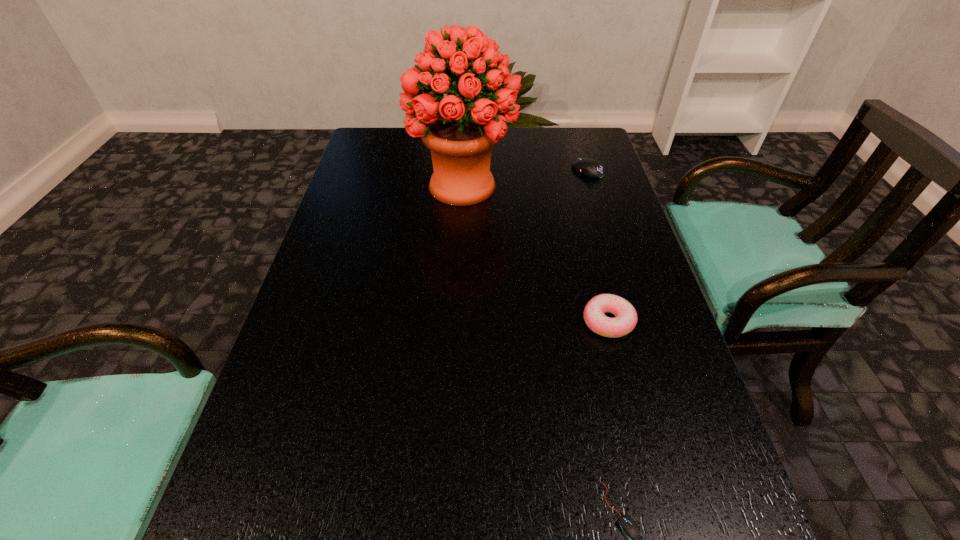
Find the location of a particular element. This screenshot has width=960, height=540. bouquet is located at coordinates (460, 138).

You are a GUI agent. You are given a task and a screenshot of the screen. Output one action in this format:
    pyautogui.click(x=<x>, y=<y>)
    Task: Click on the leftmost object
    
    Given the screenshot: What is the action you would take?
    pyautogui.click(x=460, y=138)

You are a GUI agent. You are given a task and a screenshot of the screen. Output one action in this format:
    pyautogui.click(x=<x>, y=<y>)
    Task: Click on the doughnut
    The width and height of the screenshot is (960, 540).
    Given the screenshot: What is the action you would take?
    pyautogui.click(x=625, y=320)

I want to click on the third farthest object, so click(x=625, y=320).

You are a GUI agent. You are given a task and a screenshot of the screen. Output one action in this format:
    pyautogui.click(x=<x>, y=<y>)
    Task: Click on the right mouse
    This screenshot has height=540, width=960.
    Given the screenshot: What is the action you would take?
    pyautogui.click(x=592, y=168)

The image size is (960, 540). Identify the location of the farther mouse. (592, 168).

Image resolution: width=960 pixels, height=540 pixels. In order to click on vacant space positioned on the left of the leftmost object in this screenshot , I will do `click(344, 186)`.

Where is `vacant region located 0.070m on the back of the doughnut`? The height and width of the screenshot is (540, 960). vacant region located 0.070m on the back of the doughnut is located at coordinates (597, 279).

This screenshot has height=540, width=960. I want to click on vacant region located on the front of the taller mouse, so click(x=593, y=189).

This screenshot has width=960, height=540. What are the coordinates of `bouquet positioned at the far edge` in the screenshot? It's located at (460, 138).